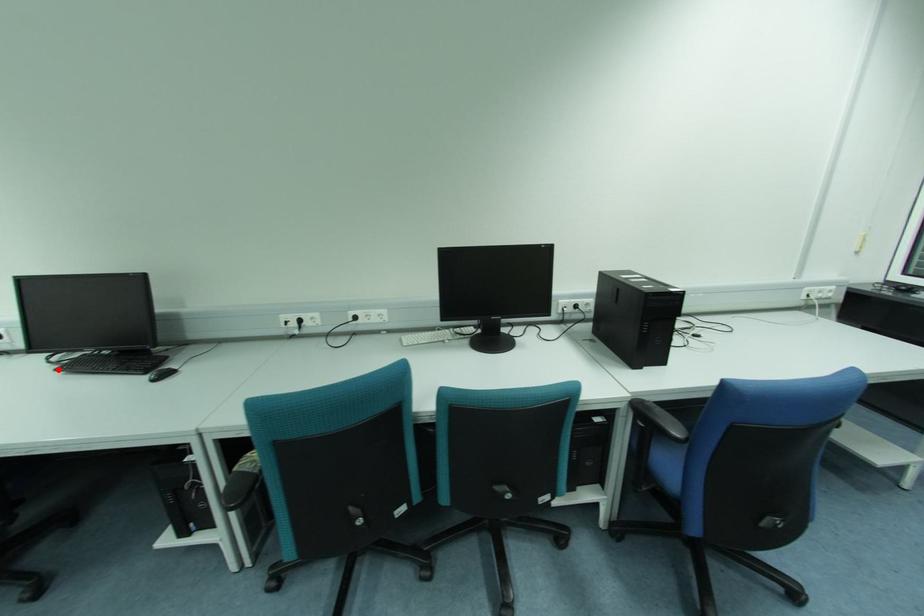
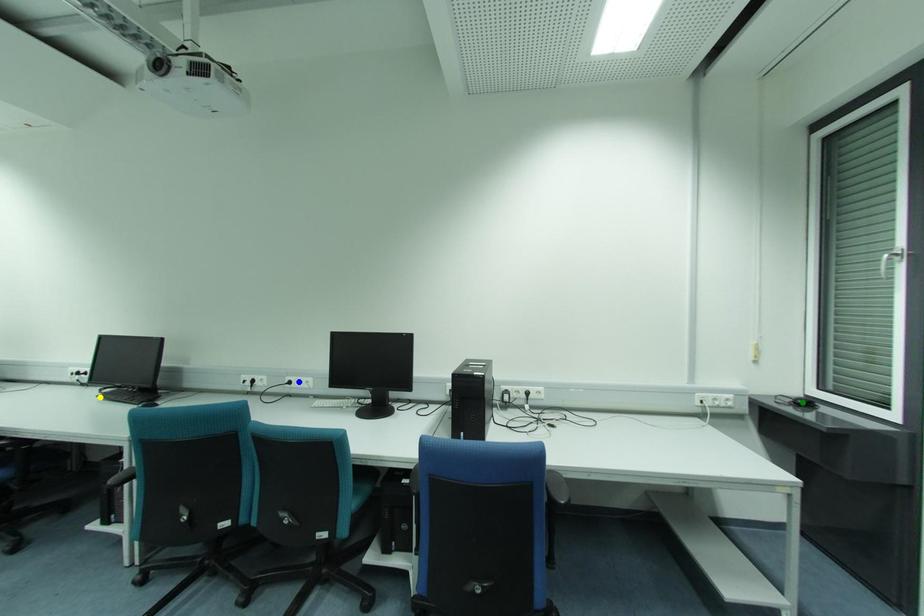
Question: I am providing you with two images of the same scene from different viewpoints. A red point is marked on the first image. You are given multiple points on the second image. In image 2, which mark is for the same physical point as the one in image 1?

Choices:
 (A) yellow point
 (B) blue point
 (C) green point

Answer: (A)